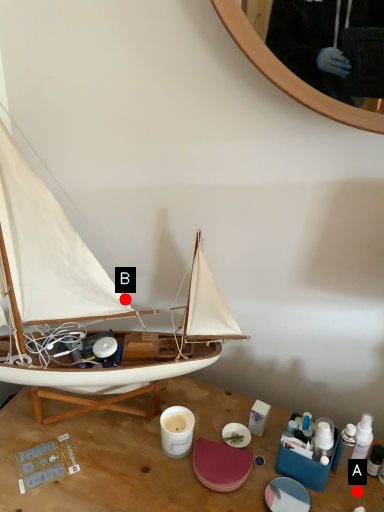
Question: Two points are circled on the image, labeled by A and B beside each circle. Which point is further to the camera?

Choices:
 (A) A is further
 (B) B is further

Answer: (B)